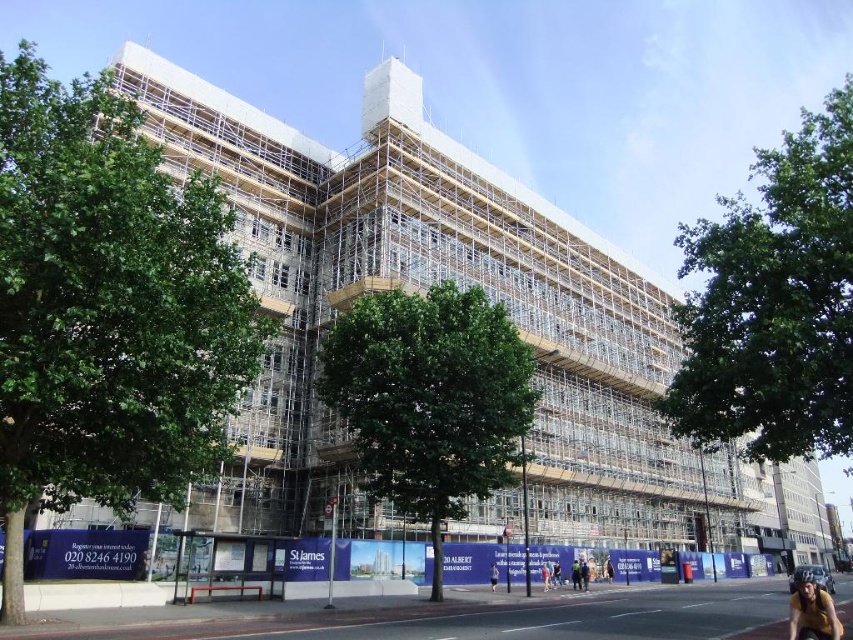
Question: Does white scaffolding at center appear under green leafy tree at upper right?

Choices:
 (A) no
 (B) yes

Answer: (B)

Question: Which point appears farthest from the camera in this image?

Choices:
 (A) (341, 356)
 (B) (799, 172)
 (C) (740, 486)

Answer: (C)

Question: Is white scaffolding at center positioned before green leafy tree at center?

Choices:
 (A) no
 (B) yes

Answer: (A)

Question: Based on their relative distances, which object is nearer to the green leafy tree at upper right?

Choices:
 (A) white scaffolding at center
 (B) green leafy tree at center
 (C) green leafy tree at left

Answer: (B)

Question: Is green leafy tree at left positioned at the back of green leafy tree at upper right?

Choices:
 (A) yes
 (B) no

Answer: (B)

Question: Among these points, which one is nearest to the camera?

Choices:
 (A) (440, 580)
 (B) (804, 404)
 (C) (67, 433)
 (D) (682, 499)

Answer: (C)